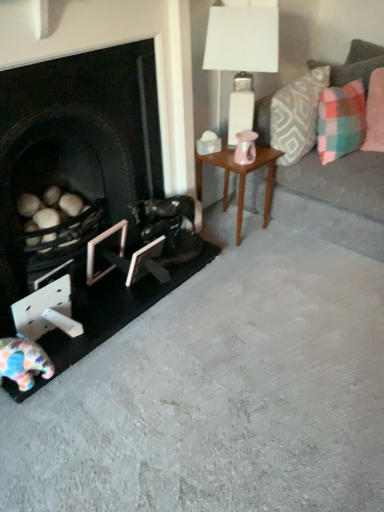
At what (x,y) coordinates should I click in order to perform the action: click on free space in front of shiny black leather swivel chair at center. Please return your answer as a coordinate pair (x, y). Looking at the image, I should click on (160, 287).